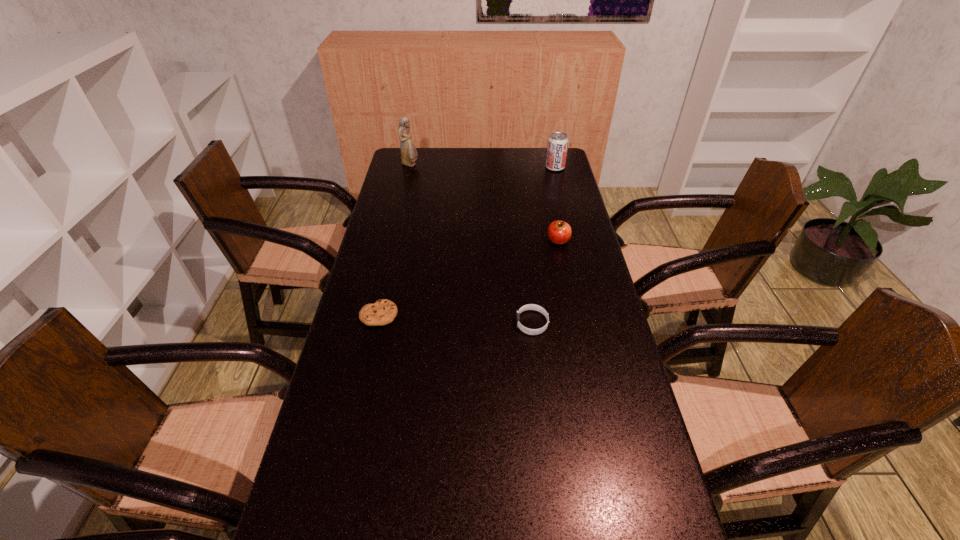
Identify the location of vacant point located 0.280m on the outer surface of the third object from left to right. (416, 323).

Where is `blank space located on the outer surface of the third object from left to right`? blank space located on the outer surface of the third object from left to right is located at coordinates (434, 323).

Locate an element on the screen. vacant space located on the outer surface of the third object from left to right is located at coordinates (477, 323).

Locate an element on the screen. This screenshot has width=960, height=540. free point located 0.160m on the front of the cookie is located at coordinates (365, 377).

This screenshot has width=960, height=540. What are the coordinates of `figurine situated at the far edge` in the screenshot? It's located at (409, 154).

Where is `soda can present at the far edge`? The width and height of the screenshot is (960, 540). soda can present at the far edge is located at coordinates (557, 147).

Locate an element on the screen. Image resolution: width=960 pixels, height=540 pixels. figurine situated at the left edge is located at coordinates (409, 154).

Locate an element on the screen. The image size is (960, 540). cookie that is at the left edge is located at coordinates (382, 312).

The height and width of the screenshot is (540, 960). In order to click on soda can that is positioned at the right edge in this screenshot , I will do `click(557, 147)`.

Identify the location of apple at the right edge. (559, 232).